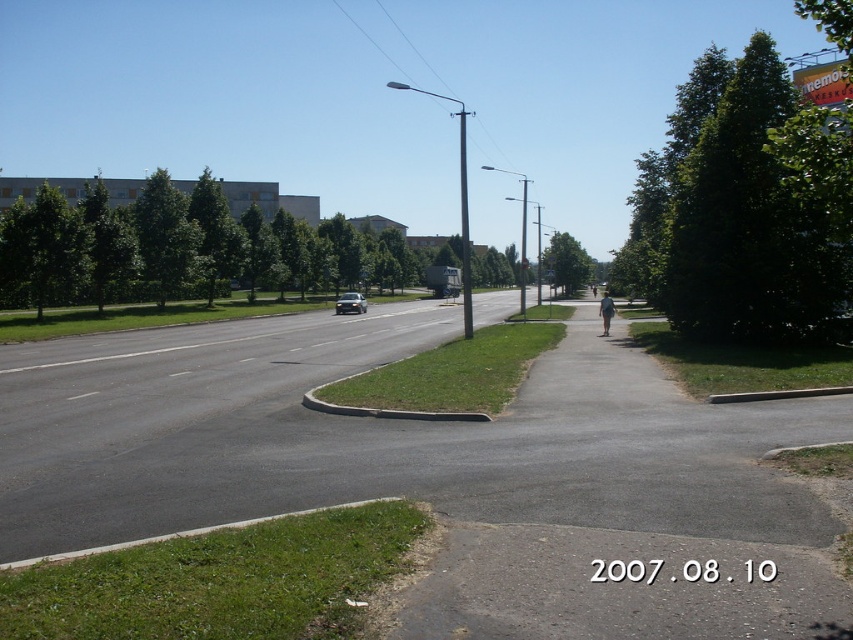
You are a driver approaching the silver metallic car at center and the white plastic street sign at center on the open road. Which object will appear taller to you as you get closer?

The white plastic street sign at center will appear taller than the silver metallic car at center because the Objects Description states that the silver metallic car at center is shorter than the white plastic street sign at center.

You are a driver approaching the silver metallic car at center and the white plastic street sign at center on the open road. Which object will appear closer to you as you drive forward?

The silver metallic car at center will appear closer because it is larger in size compared to the white plastic street sign at center, indicating it is nearer to the viewer.